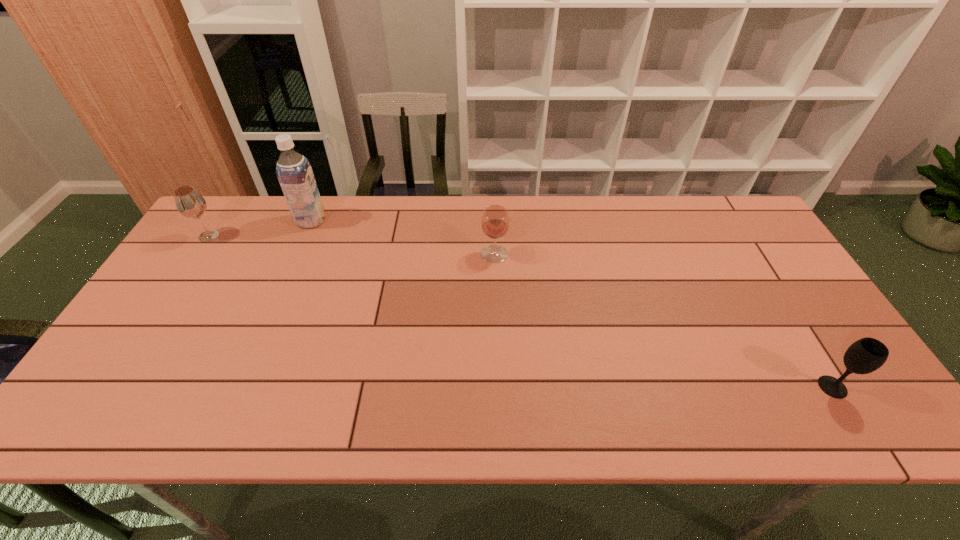
The width and height of the screenshot is (960, 540). Find the location of `empty space between the leftmost wineglass and the tallest object`. empty space between the leftmost wineglass and the tallest object is located at coordinates (260, 228).

At what (x,y) coordinates should I click in order to perform the action: click on free space between the soya milk and the farthest wineglass. Please return your answer as a coordinate pair (x, y). This screenshot has width=960, height=540. Looking at the image, I should click on (260, 228).

The height and width of the screenshot is (540, 960). I want to click on free space between the leftmost object and the second wineglass from right to left, so click(351, 245).

At what (x,y) coordinates should I click in order to perform the action: click on vacant space in between the nearest object and the soya milk. Please return your answer as a coordinate pair (x, y). Image resolution: width=960 pixels, height=540 pixels. Looking at the image, I should click on (572, 304).

The image size is (960, 540). What are the coordinates of `free space between the second farthest wineglass and the rightmost wineglass` in the screenshot? It's located at (663, 321).

Locate an element on the screen. object that is the second closest to the nearest wineglass is located at coordinates (294, 172).

Locate which object is the second closest to the tallest object. Please provide its 2D coordinates. Your answer should be formatted as a tuple, i.e. [(x, y)], where the tuple contains the x and y coordinates of a point satisfying the conditions above.

[(495, 221)]

Identify which wineglass is the nearest to the farthest wineglass. Please provide its 2D coordinates. Your answer should be formatted as a tuple, i.e. [(x, y)], where the tuple contains the x and y coordinates of a point satisfying the conditions above.

[(495, 221)]

Identify which wineglass is located as the nearest to the leftmost wineglass. Please provide its 2D coordinates. Your answer should be formatted as a tuple, i.e. [(x, y)], where the tuple contains the x and y coordinates of a point satisfying the conditions above.

[(495, 221)]

This screenshot has height=540, width=960. Identify the location of vacant position in the image that satisfies the following two spatial constraints: 1. on the label of the third object from left to right; 2. on the right side of the soya milk. (297, 254).